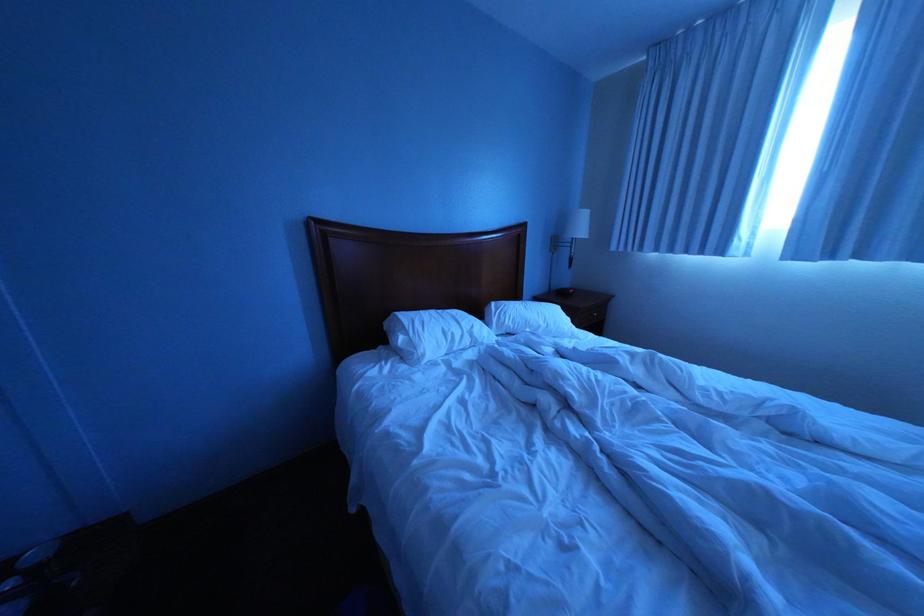
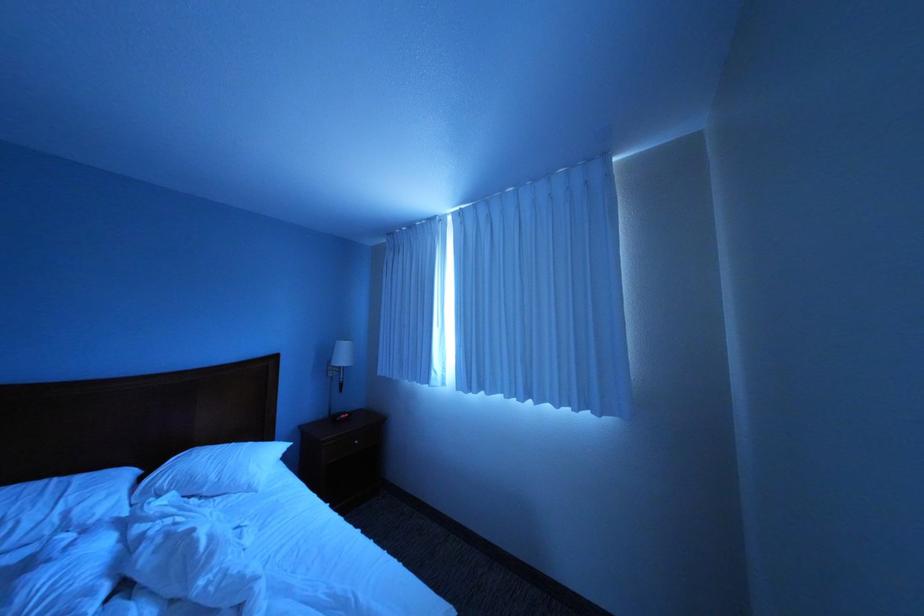
Question: Which direction would the cameraman need to move to produce the second image? Reply with the corresponding letter.

Choices:
 (A) Left
 (B) Right
 (C) Forward
 (D) Backward

Answer: (B)